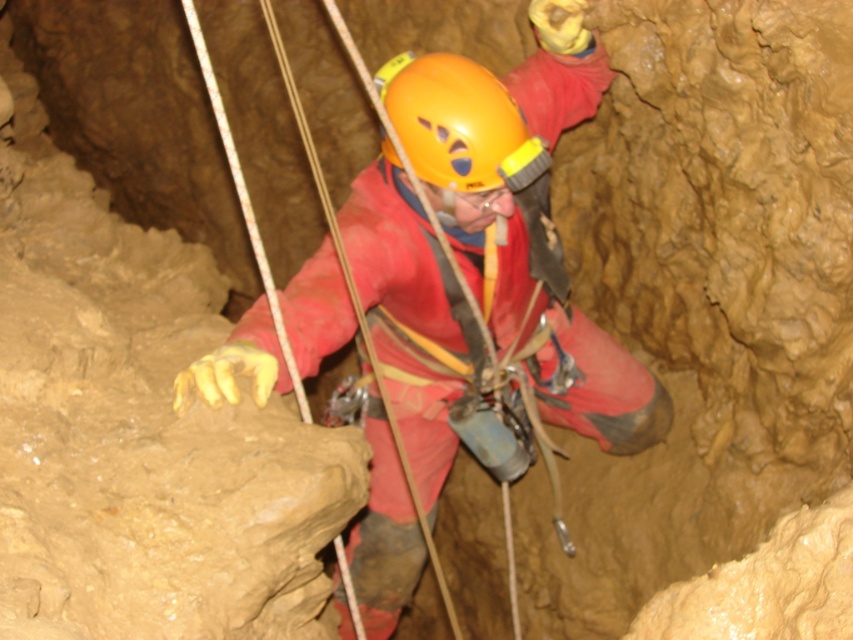
Does matte red jumpsuit at center have a greater height compared to orange matte helmet at center?

Indeed, matte red jumpsuit at center has a greater height compared to orange matte helmet at center.

Who is taller, matte red jumpsuit at center or orange matte helmet at center?

matte red jumpsuit at center

Does point (593, 408) come closer to viewer compared to point (393, 150)?

No, (593, 408) is further to viewer.

Where is `matte red jumpsuit at center`? This screenshot has width=853, height=640. matte red jumpsuit at center is located at coordinates [x=494, y=221].